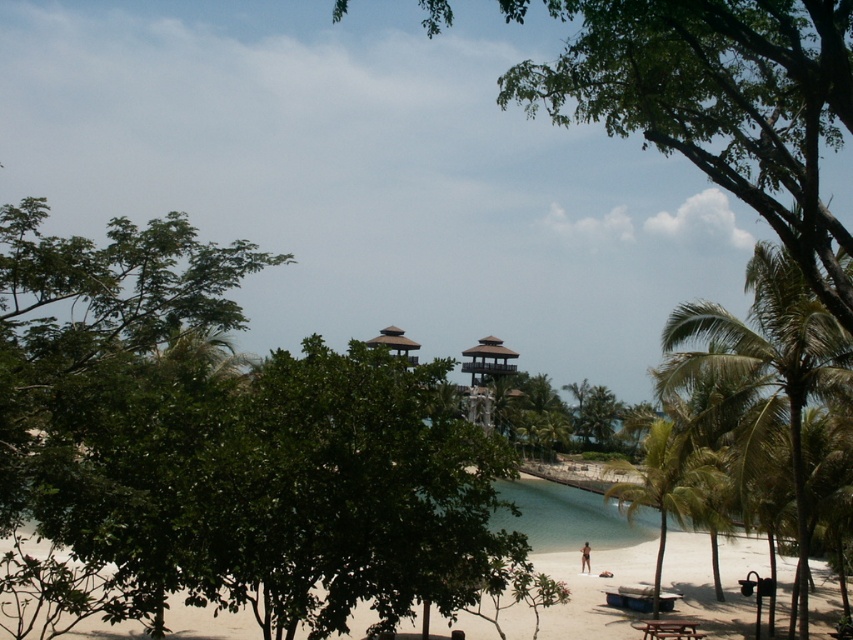
Does green leafy palm tree at lower right have a lesser height compared to brown skin at lower center?

No, green leafy palm tree at lower right is not shorter than brown skin at lower center.

Which is more to the right, green leafy palm tree at lower right or brown skin at lower center?

green leafy palm tree at lower right

Describe the element at coordinates (669, 484) in the screenshot. Image resolution: width=853 pixels, height=640 pixels. I see `green leafy palm tree at lower right` at that location.

Locate an element on the screen. The image size is (853, 640). green leafy palm tree at lower right is located at coordinates (669, 484).

Can you confirm if green leafy palm tree at lower right is bigger than wooden gazebo at center?

Yes.

Which is behind, point (647, 451) or point (390, 344)?

Point (390, 344)

Where is `green leafy palm tree at lower right`? This screenshot has height=640, width=853. green leafy palm tree at lower right is located at coordinates (669, 484).

Who is more distant from viewer, (664, 365) or (383, 344)?

Positioned behind is point (383, 344).

Is point (767, 385) positioned behind point (380, 339)?

No, (767, 385) is closer to viewer.

At what (x,y) coordinates should I click in order to perform the action: click on green leafy palm tree at right. Please return your answer as a coordinate pair (x, y). This screenshot has height=640, width=853. Looking at the image, I should click on (767, 356).